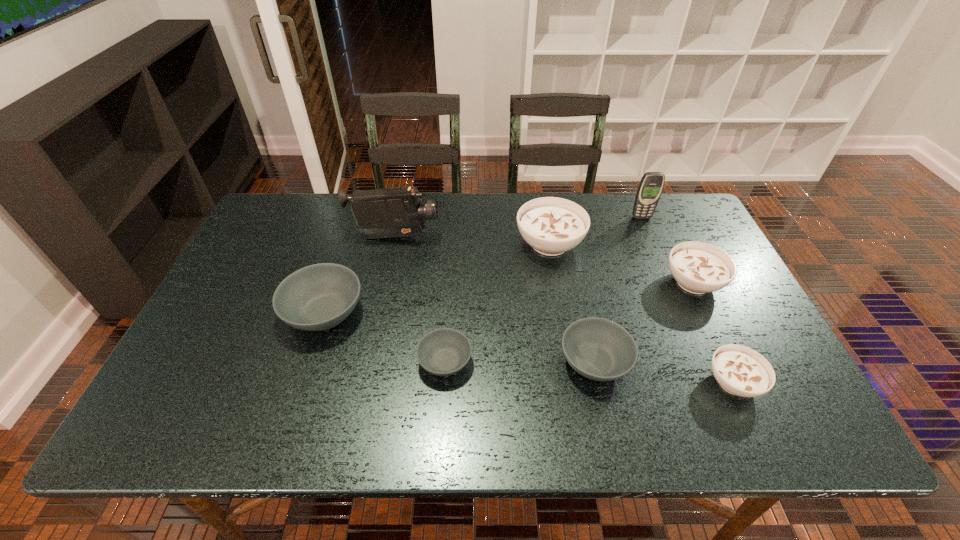
Find the location of a particular element. vacant point at the right edge is located at coordinates (679, 286).

Where is `vacant space at the far left corner of the desktop`? The width and height of the screenshot is (960, 540). vacant space at the far left corner of the desktop is located at coordinates (288, 216).

Image resolution: width=960 pixels, height=540 pixels. What are the coordinates of `blank space at the far right corner of the desktop` in the screenshot? It's located at (668, 211).

I want to click on vacant space that is in between the tallest soup bowl and the second smallest white soup bowl, so click(621, 263).

Find the location of a particular element. This screenshot has width=960, height=540. empty location between the leftmost soup bowl and the nearest white soup bowl is located at coordinates (529, 348).

Image resolution: width=960 pixels, height=540 pixels. What are the coordinates of `vacant space in between the second biggest white soup bowl and the shortest soup bowl` in the screenshot? It's located at click(569, 322).

Find the location of `free space between the smallest white soup bowl and the second biggest white soup bowl`. free space between the smallest white soup bowl and the second biggest white soup bowl is located at coordinates (713, 333).

This screenshot has width=960, height=540. Identify the location of blank region between the tallest soup bowl and the biggest gray soup bowl. (437, 278).

At what (x,y) coordinates should I click in order to perform the action: click on vacant space that is in between the tallest soup bowl and the smallest white soup bowl. Please return your answer as a coordinate pair (x, y). This screenshot has height=540, width=960. Looking at the image, I should click on (641, 313).

Image resolution: width=960 pixels, height=540 pixels. I want to click on free space that is in between the farthest object and the shortest soup bowl, so click(543, 289).